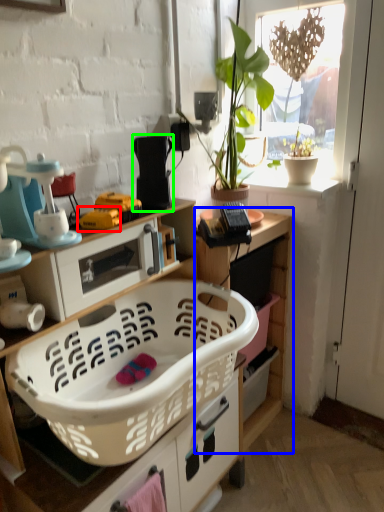
Question: Estimate the real-world distances between objects in this image. Which object is closer to toy (highlighted by a red box), cabinetry (highlighted by a blue box) or appliance (highlighted by a green box)?

Choices:
 (A) cabinetry
 (B) appliance

Answer: (B)